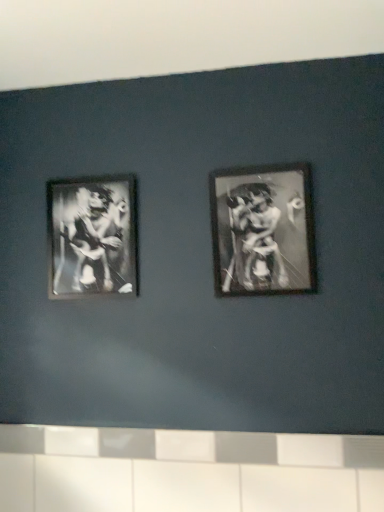
At what (x,y) coordinates should I click in order to perform the action: click on metallic silver frame at center right, the 2th picture frame viewed from the left. Please return your answer as a coordinate pair (x, y). Image resolution: width=384 pixels, height=512 pixels. Looking at the image, I should click on (263, 230).

Where is `metallic silver frame at center right, arranged as the first picture frame when viewed from the front`? metallic silver frame at center right, arranged as the first picture frame when viewed from the front is located at coordinates (263, 230).

From a real-world perspective, is metallic silver frame at center right, which ranks as the 2th picture frame in back-to-front order, over white glossy tile at lower center?

Yes, from a real-world perspective, metallic silver frame at center right, which ranks as the 2th picture frame in back-to-front order, is on top of white glossy tile at lower center.

Which object is positioned more to the right, metallic silver frame at center right, arranged as the first picture frame when viewed from the front, or white glossy tile at lower center?

Positioned to the right is metallic silver frame at center right, arranged as the first picture frame when viewed from the front.

Would you say metallic silver frame at center right, which ranks as the 2th picture frame in back-to-front order, is inside or outside white glossy tile at lower center?

metallic silver frame at center right, which ranks as the 2th picture frame in back-to-front order, is located beyond the bounds of white glossy tile at lower center.

Which object is closer to the camera, metallic silver frame at center right, which ranks as the 2th picture frame in back-to-front order, or white glossy tile at lower center?

white glossy tile at lower center is in front.

Consider the image. Is metallic silver frame at left, which is the 2th picture frame from front to back, closer to camera compared to metallic silver frame at center right, arranged as the first picture frame when viewed from the front?

No, metallic silver frame at left, which is the 2th picture frame from front to back, is further to the viewer.

Is metallic silver frame at left, marked as the 1th picture frame in a left-to-right arrangement, beside metallic silver frame at center right, which ranks as the 2th picture frame in back-to-front order?

No, metallic silver frame at left, marked as the 1th picture frame in a left-to-right arrangement, is not making contact with metallic silver frame at center right, which ranks as the 2th picture frame in back-to-front order.

Which is farther from the camera, (120,191) or (250,248)?

The point (120,191) is more distant.

From the image's perspective, which one is positioned higher, metallic silver frame at left, marked as the 1th picture frame in a left-to-right arrangement, or metallic silver frame at center right, which ranks as the 1th picture frame in right-to-left order?

metallic silver frame at center right, which ranks as the 1th picture frame in right-to-left order, appears higher in the image.

Between white glossy tile at lower center and metallic silver frame at left, positioned as the 2th picture frame in right-to-left order, which one is positioned behind?

metallic silver frame at left, positioned as the 2th picture frame in right-to-left order, is further from the camera.

Based on their positions, is white glossy tile at lower center located to the left or right of metallic silver frame at left, which appears as the first picture frame when viewed from the back?

Based on their positions, white glossy tile at lower center is located to the right of metallic silver frame at left, which appears as the first picture frame when viewed from the back.

Where is `ledge on the right of metallic silver frame at left, which appears as the first picture frame when viewed from the back`? This screenshot has width=384, height=512. ledge on the right of metallic silver frame at left, which appears as the first picture frame when viewed from the back is located at coordinates (187, 470).

Considering the points (134, 453) and (132, 289), which point is behind, point (134, 453) or point (132, 289)?

Point (132, 289)

Is white glossy tile at lower center not inside metallic silver frame at center right, the 2th picture frame viewed from the left?

white glossy tile at lower center lies outside metallic silver frame at center right, the 2th picture frame viewed from the left,'s area.

In the image, is white glossy tile at lower center on the left side or the right side of metallic silver frame at center right, the 2th picture frame viewed from the left?

white glossy tile at lower center is positioned on metallic silver frame at center right, the 2th picture frame viewed from the left,'s left side.

From the image's perspective, is white glossy tile at lower center below metallic silver frame at center right, which ranks as the 2th picture frame in back-to-front order?

Yes.

Which object is further away from the camera taking this photo, metallic silver frame at left, which appears as the first picture frame when viewed from the back, or white glossy tile at lower center?

metallic silver frame at left, which appears as the first picture frame when viewed from the back.

Is metallic silver frame at left, positioned as the 2th picture frame in right-to-left order, looking in the opposite direction of white glossy tile at lower center?

No, metallic silver frame at left, positioned as the 2th picture frame in right-to-left order, is not facing the opposite direction of white glossy tile at lower center.

From a real-world perspective, which object stands above the other?

From a 3D spatial view, metallic silver frame at left, which is the 2th picture frame from front to back, is above.

Is metallic silver frame at left, marked as the 1th picture frame in a left-to-right arrangement, next to white glossy tile at lower center and touching it?

They are not placed beside each other.

From a real-world perspective, relative to metallic silver frame at left, positioned as the 2th picture frame in right-to-left order, is metallic silver frame at center right, arranged as the first picture frame when viewed from the front, vertically above or below?

From a real-world perspective, metallic silver frame at center right, arranged as the first picture frame when viewed from the front, is physically below metallic silver frame at left, positioned as the 2th picture frame in right-to-left order.

From the image's perspective, is metallic silver frame at center right, the 2th picture frame viewed from the left, located beneath metallic silver frame at left, which appears as the first picture frame when viewed from the back?

No, from the image's perspective, metallic silver frame at center right, the 2th picture frame viewed from the left, is not beneath metallic silver frame at left, which appears as the first picture frame when viewed from the back.

Is the position of metallic silver frame at center right, which ranks as the 2th picture frame in back-to-front order, more distant than that of metallic silver frame at left, positioned as the 2th picture frame in right-to-left order?

No, metallic silver frame at center right, which ranks as the 2th picture frame in back-to-front order, is in front of metallic silver frame at left, positioned as the 2th picture frame in right-to-left order.

Is metallic silver frame at center right, which ranks as the 2th picture frame in back-to-front order, touching metallic silver frame at left, marked as the 1th picture frame in a left-to-right arrangement?

No, metallic silver frame at center right, which ranks as the 2th picture frame in back-to-front order, is not beside metallic silver frame at left, marked as the 1th picture frame in a left-to-right arrangement.

Starting from the white glossy tile at lower center, which picture frame is the 1st one behind? Please provide its 2D coordinates.

[(263, 230)]

Find the location of a particular element. The width and height of the screenshot is (384, 512). picture frame in front of the metallic silver frame at left, which appears as the first picture frame when viewed from the back is located at coordinates 263,230.

Considering their positions, is metallic silver frame at left, marked as the 1th picture frame in a left-to-right arrangement, positioned closer to white glossy tile at lower center than metallic silver frame at center right, which ranks as the 1th picture frame in right-to-left order?

metallic silver frame at center right, which ranks as the 1th picture frame in right-to-left order, is positioned closer to the anchor white glossy tile at lower center.

Consider the image. Estimate the real-world distances between objects in this image. Which object is further from metallic silver frame at center right, which ranks as the 1th picture frame in right-to-left order, metallic silver frame at left, which appears as the first picture frame when viewed from the back, or white glossy tile at lower center?

The object further to metallic silver frame at center right, which ranks as the 1th picture frame in right-to-left order, is white glossy tile at lower center.

Estimate the real-world distances between objects in this image. Which object is further from metallic silver frame at center right, arranged as the first picture frame when viewed from the front, white glossy tile at lower center or metallic silver frame at left, which appears as the first picture frame when viewed from the back?

Based on the image, white glossy tile at lower center appears to be further to metallic silver frame at center right, arranged as the first picture frame when viewed from the front.

From the image, which object appears to be nearer to metallic silver frame at left, positioned as the 2th picture frame in right-to-left order, metallic silver frame at center right, arranged as the first picture frame when viewed from the front, or white glossy tile at lower center?

Based on the image, metallic silver frame at center right, arranged as the first picture frame when viewed from the front, appears to be nearer to metallic silver frame at left, positioned as the 2th picture frame in right-to-left order.

Estimate the real-world distances between objects in this image. Which object is closer to metallic silver frame at left, positioned as the 2th picture frame in right-to-left order, white glossy tile at lower center or metallic silver frame at center right, which ranks as the 2th picture frame in back-to-front order?

The object closer to metallic silver frame at left, positioned as the 2th picture frame in right-to-left order, is metallic silver frame at center right, which ranks as the 2th picture frame in back-to-front order.

When comparing their distances from white glossy tile at lower center, does metallic silver frame at center right, which ranks as the 1th picture frame in right-to-left order, or metallic silver frame at left, which appears as the first picture frame when viewed from the back, seem closer?

Among the two, metallic silver frame at center right, which ranks as the 1th picture frame in right-to-left order, is located nearer to white glossy tile at lower center.

Identify the location of picture frame between metallic silver frame at center right, arranged as the first picture frame when viewed from the front, and white glossy tile at lower center vertically. The width and height of the screenshot is (384, 512). (92, 236).